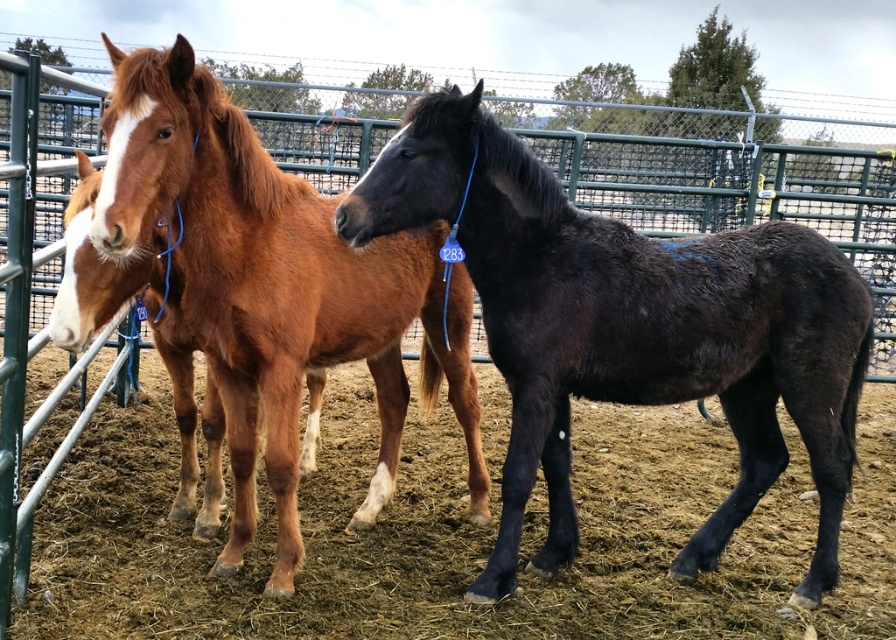
Which is above, brown hay at lower center or black glossy horse at center?

Positioned higher is black glossy horse at center.

Between point (185, 621) and point (593, 396), which one is positioned behind?

The point (593, 396) is more distant.

You are a GUI agent. You are given a task and a screenshot of the screen. Output one action in this format:
    pyautogui.click(x=<x>, y=<y>)
    Task: Click on the brown hay at lower center
    
    Given the screenshot: What is the action you would take?
    tap(458, 536)

Which of these two, brown glossy horse at center or green metal fence at center, stands taller?

With more height is brown glossy horse at center.

Does brown glossy horse at center have a smaller size compared to green metal fence at center?

No, brown glossy horse at center is not smaller than green metal fence at center.

Identify the location of brown glossy horse at center. (274, 285).

Locate an element on the screen. brown glossy horse at center is located at coordinates (274, 285).

Which is behind, point (220, 612) or point (197, 266)?

Positioned behind is point (220, 612).

Who is positioned more to the right, brown hay at lower center or brown glossy horse at center?

From the viewer's perspective, brown hay at lower center appears more on the right side.

Locate an element on the screen. brown hay at lower center is located at coordinates (458, 536).

This screenshot has width=896, height=640. Find the location of `brown hay at lower center`. brown hay at lower center is located at coordinates (458, 536).